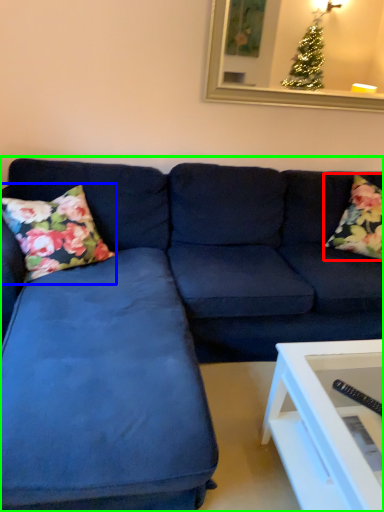
Question: Estimate the real-world distances between objects in this image. Which object is farther from pillow (highlighted by a red box), pillow (highlighted by a blue box) or studio couch (highlighted by a green box)?

Choices:
 (A) pillow
 (B) studio couch

Answer: (A)